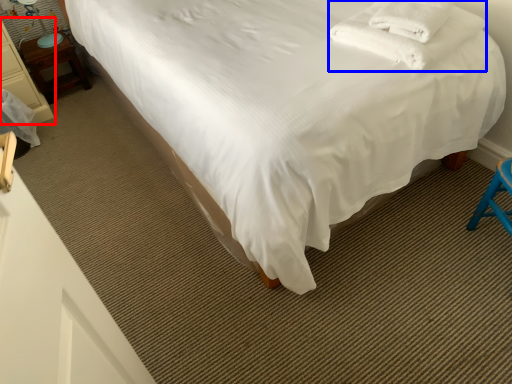
Question: Which point is further to the camera, furniture (highlighted by a red box) or blanket (highlighted by a blue box)?

Choices:
 (A) furniture
 (B) blanket

Answer: (A)